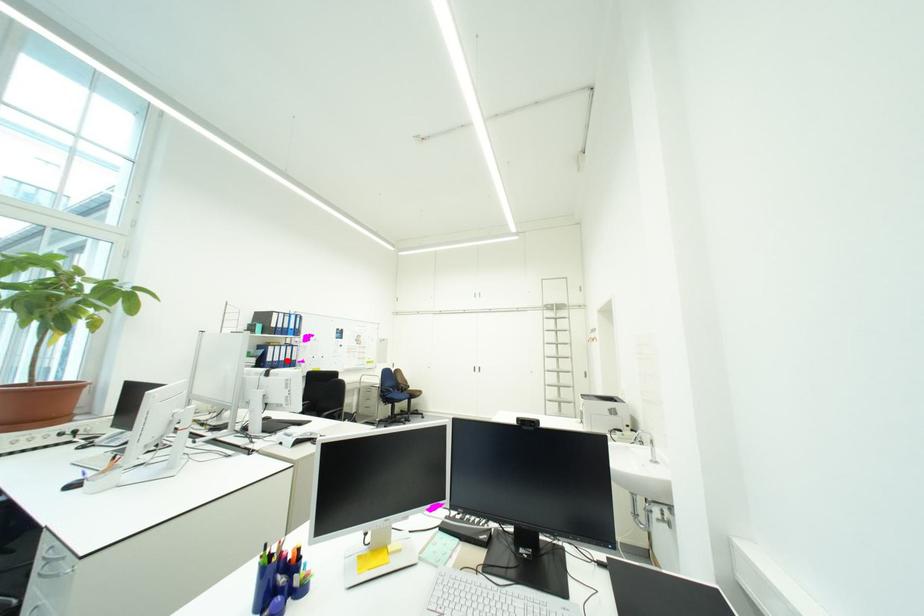
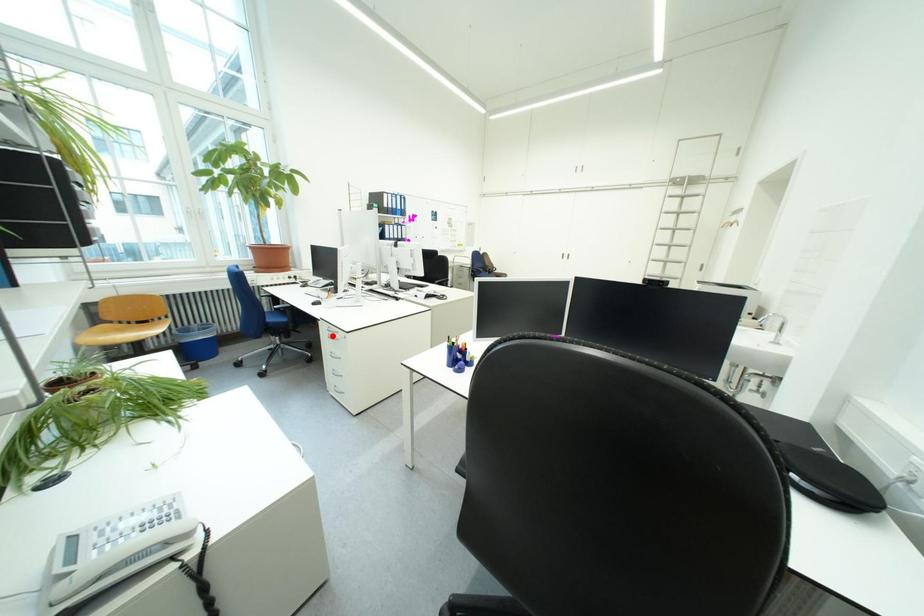
I am providing you with two images of the same scene from different viewpoints. A red point is marked on the first image and another point is marked on the second image. Is the marked point in image1 the same physical position as the marked point in image2?

No